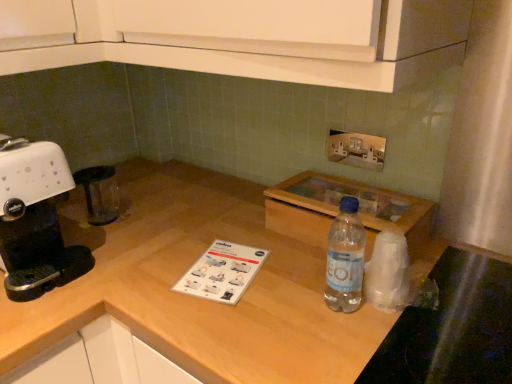
Where is `vacant space to the left of transparent plastic bag at right`? vacant space to the left of transparent plastic bag at right is located at coordinates (287, 294).